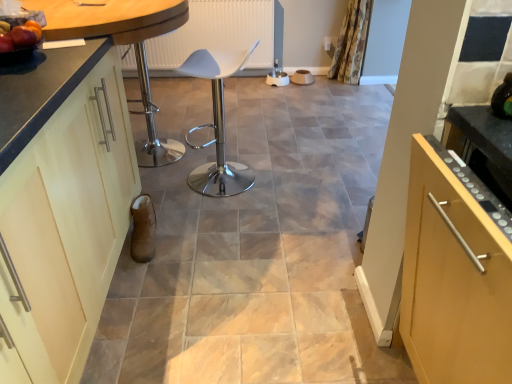
Question: Considering the positions of matte cream cabinet at left and white plastic chair at center in the image, is matte cream cabinet at left taller or shorter than white plastic chair at center?

Choices:
 (A) short
 (B) tall

Answer: (B)

Question: Considering the positions of matte cream cabinet at left and white plastic chair at center in the image, is matte cream cabinet at left wider or thinner than white plastic chair at center?

Choices:
 (A) wide
 (B) thin

Answer: (A)

Question: Which is nearer to the matte black countertop at left?

Choices:
 (A) metallic silver bar stool at center
 (B) white plastic chair at center
 (C) floral fabric curtain at upper right
 (D) matte cream cabinet at left

Answer: (D)

Question: Which is farther from the floral fabric curtain at upper right?

Choices:
 (A) white plastic chair at center
 (B) metallic silver bar stool at center
 (C) matte cream cabinet at left
 (D) matte black countertop at left

Answer: (C)